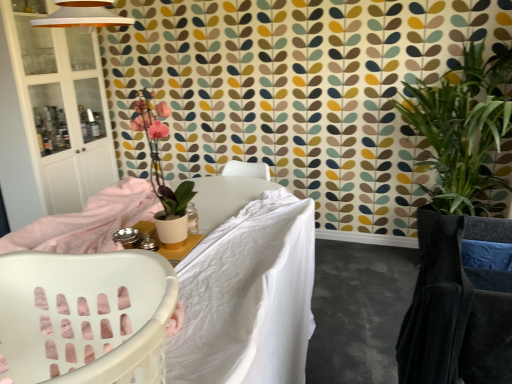
At what (x,y) coordinates should I click in order to perform the action: click on vacant space to the right of matte white table at center. Please return your answer as a coordinate pair (x, y). The width and height of the screenshot is (512, 384). Looking at the image, I should click on (221, 256).